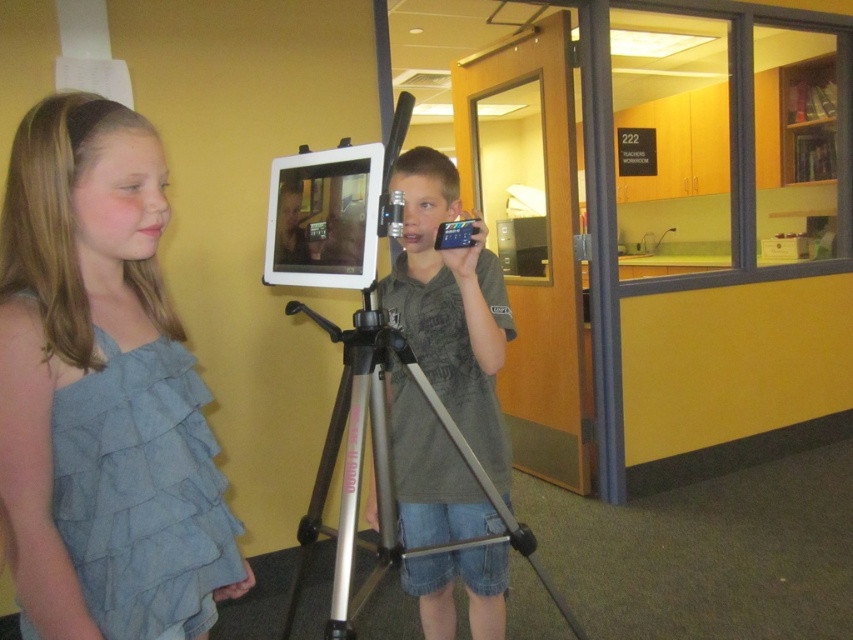
Is denim ruffled top at left further to camera compared to silver metallic tripod at center?

No, it is in front of silver metallic tripod at center.

Between denim ruffled top at left and silver metallic tripod at center, which one appears on the left side from the viewer's perspective?

Positioned to the left is denim ruffled top at left.

Is point (68, 310) farther from camera compared to point (354, 458)?

No.

You are a GUI agent. You are given a task and a screenshot of the screen. Output one action in this format:
    pyautogui.click(x=<x>, y=<y>)
    Task: Click on the denim ruffled top at left
    The image size is (853, 640).
    Given the screenshot: What is the action you would take?
    pyautogui.click(x=93, y=362)

Which is above, denim ruffled top at left or gray cotton shirt at center?

Positioned higher is denim ruffled top at left.

Is point (125, 168) positioned in front of point (434, 604)?

Yes, point (125, 168) is closer to viewer.

What are the coordinates of `denim ruffled top at left` in the screenshot? It's located at (93, 362).

Who is lower down, gray cotton shirt at center or silver metallic tripod at center?

silver metallic tripod at center

This screenshot has width=853, height=640. I want to click on gray cotton shirt at center, so click(x=451, y=307).

Who is more distant from viewer, (480, 497) or (465, 540)?

Point (480, 497)

This screenshot has height=640, width=853. In order to click on gray cotton shirt at center in this screenshot , I will do `click(451, 307)`.